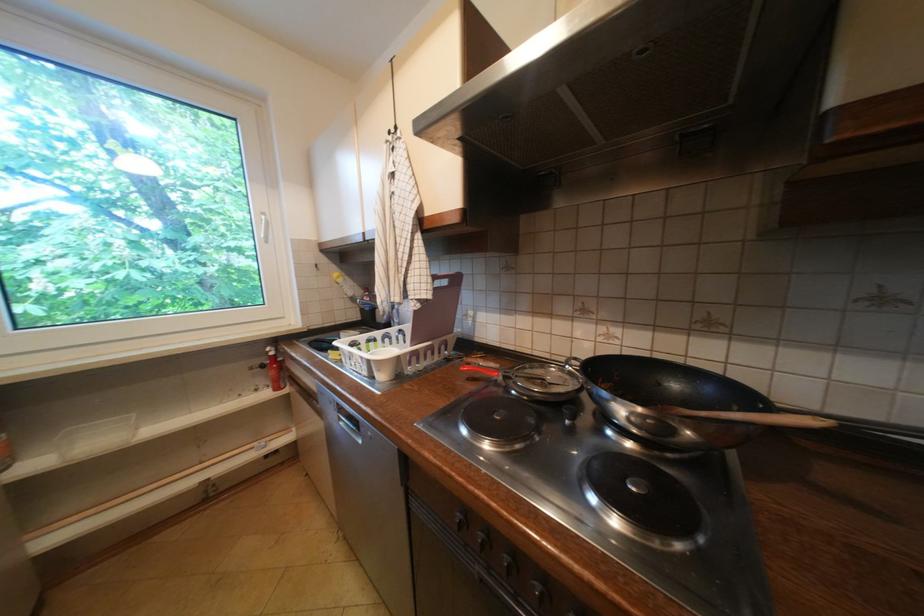
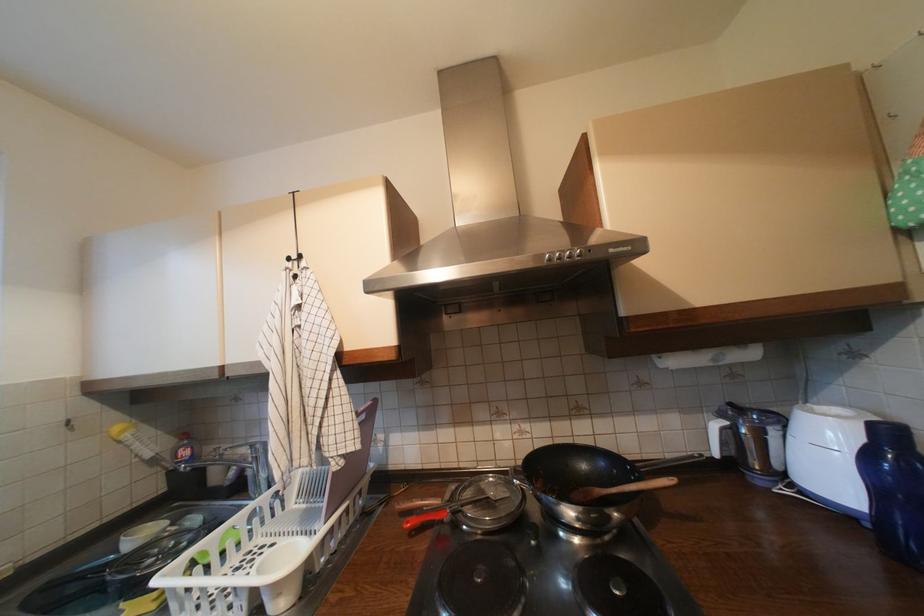
The point at (472,369) is marked in the first image. Where is the corresponding point in the second image?

(417, 524)